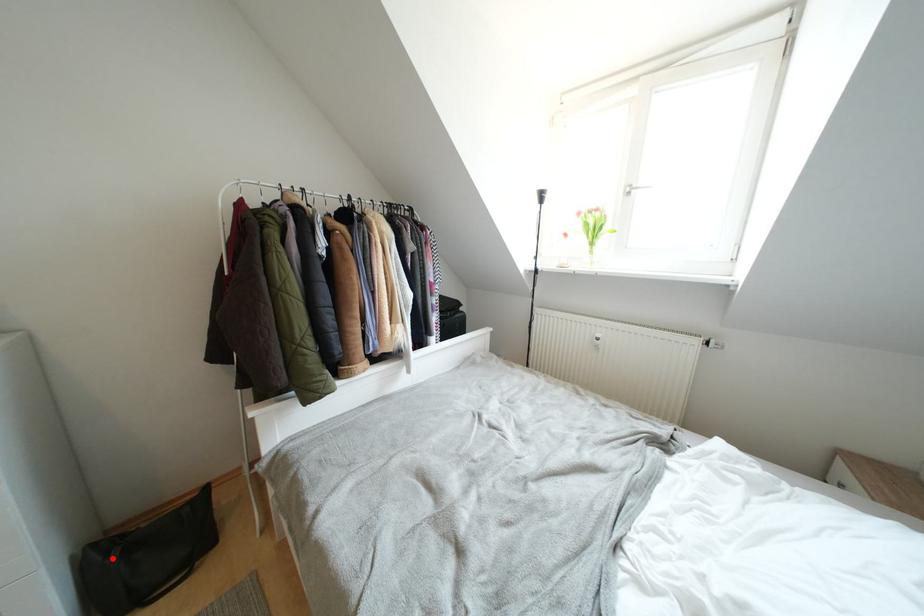
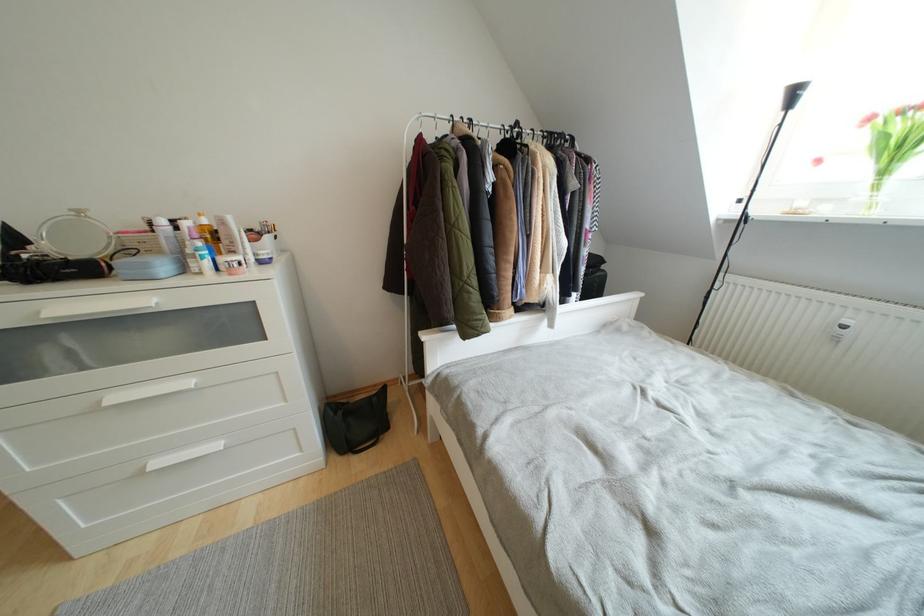
Locate, in the second image, the point that corresponds to the highlighted location in the first image.

(341, 416)